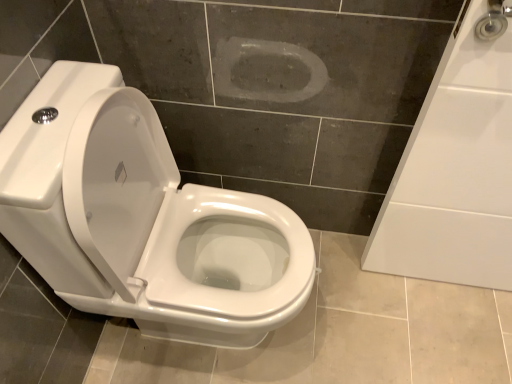
Measure the distance between point (288,258) and camera.

Point (288,258) is 1.14 meters from camera.

What are the coordinates of `white glossy toilet at left` in the screenshot? It's located at (142, 219).

What do you see at coordinates (142, 219) in the screenshot?
I see `white glossy toilet at left` at bounding box center [142, 219].

In order to click on white glossy toilet at left in this screenshot , I will do `click(142, 219)`.